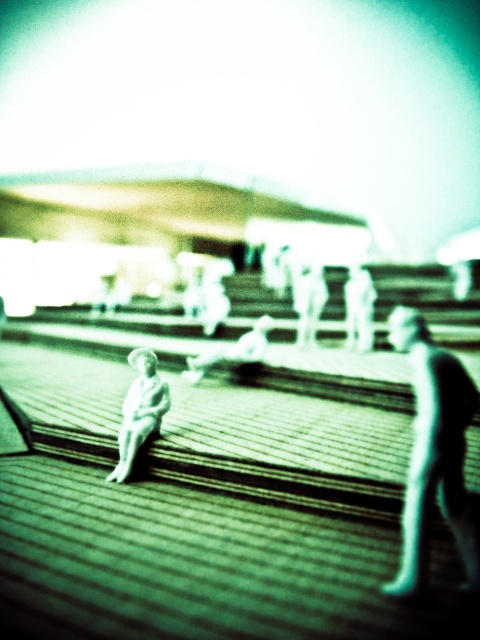
Question: Which point is closer to the camera?

Choices:
 (A) (441, 486)
 (B) (136, 388)

Answer: (A)

Question: Among these objects, which one is farthest from the camera?

Choices:
 (A) white glossy statue at lower left
 (B) smooth black figure at right

Answer: (A)

Question: Observing the image, what is the correct spatial positioning of smooth black figure at right in reference to white glossy statue at lower left?

Choices:
 (A) below
 (B) above

Answer: (B)

Question: Which point is closer to the camera?

Choices:
 (A) smooth black figure at right
 (B) white glossy statue at lower left

Answer: (A)

Question: Does smooth black figure at right have a greater width compared to white glossy statue at lower left?

Choices:
 (A) no
 (B) yes

Answer: (B)

Question: Does smooth black figure at right come in front of white glossy statue at lower left?

Choices:
 (A) yes
 (B) no

Answer: (A)